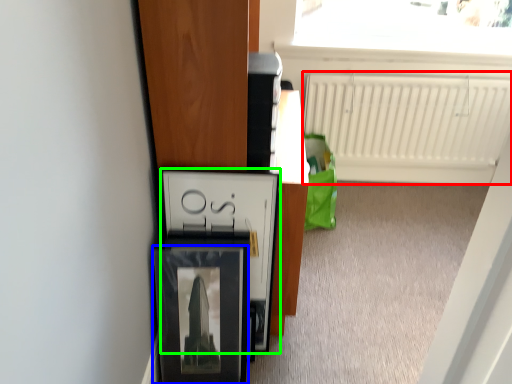
Question: Based on their relative distances, which object is farther from radiator (highlighted by a red box)? Choose from picture frame (highlighted by a blue box) and cabinetry (highlighted by a green box).

Choices:
 (A) picture frame
 (B) cabinetry

Answer: (A)